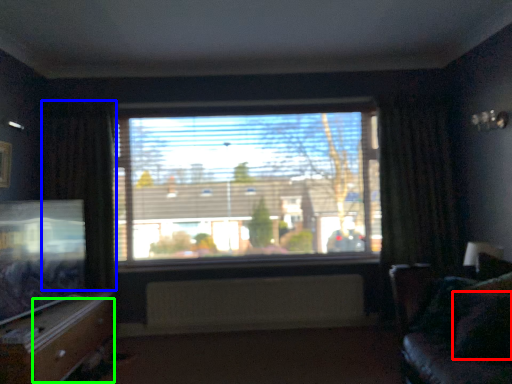
Question: Which is farther away from pillow (highlighted by a red box)? curtain (highlighted by a blue box) or drawer (highlighted by a green box)?

Choices:
 (A) curtain
 (B) drawer

Answer: (A)